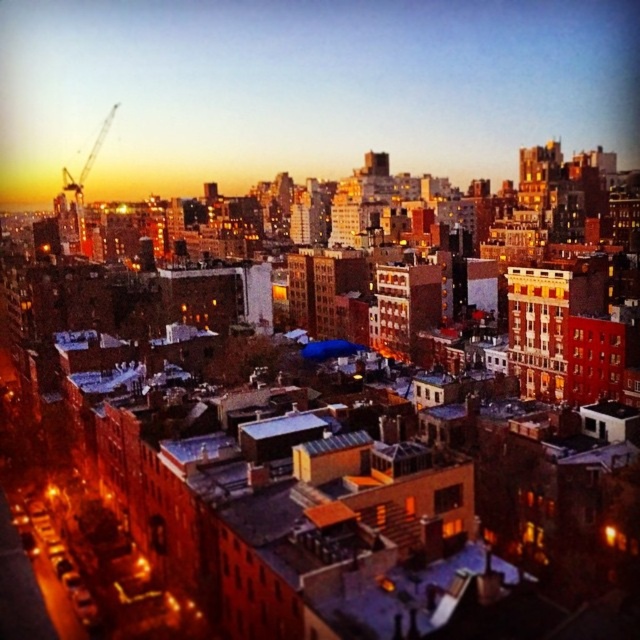
Does matte concrete buildings at center come in front of metallic construction crane at upper left?

No, matte concrete buildings at center is behind metallic construction crane at upper left.

Does matte concrete buildings at center appear on the left side of metallic construction crane at upper left?

In fact, matte concrete buildings at center is to the right of metallic construction crane at upper left.

What do you see at coordinates (305, 88) in the screenshot? The width and height of the screenshot is (640, 640). I see `matte concrete buildings at center` at bounding box center [305, 88].

At what (x,y) coordinates should I click in order to perform the action: click on matte concrete buildings at center. Please return your answer as a coordinate pair (x, y). This screenshot has width=640, height=640. Looking at the image, I should click on (305, 88).